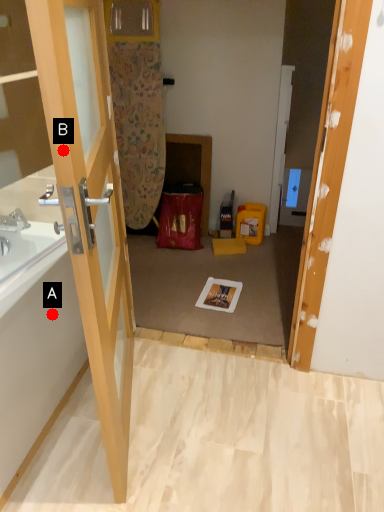
Question: Two points are circled on the image, labeled by A and B beside each circle. Which point is closer to the camera?

Choices:
 (A) A is closer
 (B) B is closer

Answer: (B)